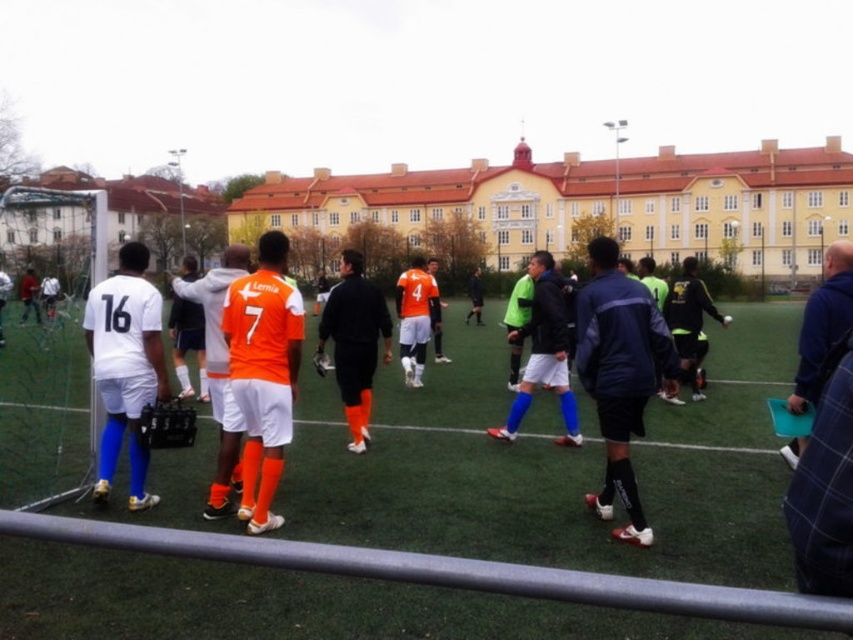
You are a soccer fan watching the match and want to take a photo of the orange jersey at center and the matte white jersey at left. Which player is positioned to the right of the other?

The matte white jersey at left is positioned to the right of the orange jersey at center.

You are a photographer standing behind the players. You want to take a photo where the matte white jersey at left and the orange jersey at center are both visible. Given their heights, which jersey will appear smaller in the photo?

The matte white jersey at left has a lesser height compared to orange jersey at center, so it will appear smaller in the photo.

You are a photographer standing at the center of the soccer field. You want to capture a photo of the metallic gray rail at lower center located at point (450, 572). Which direction should you face to ensure the rail is in the center of your camera frame?

You should face towards the lower center direction to center the metallic gray rail at lower center in your camera frame.